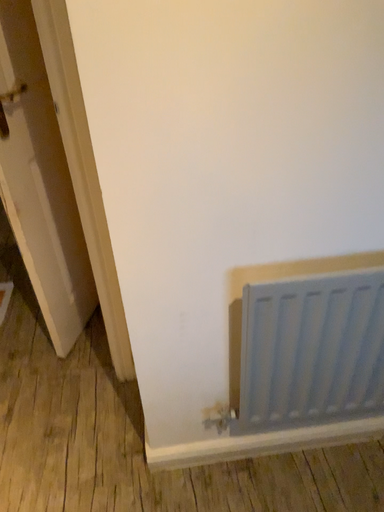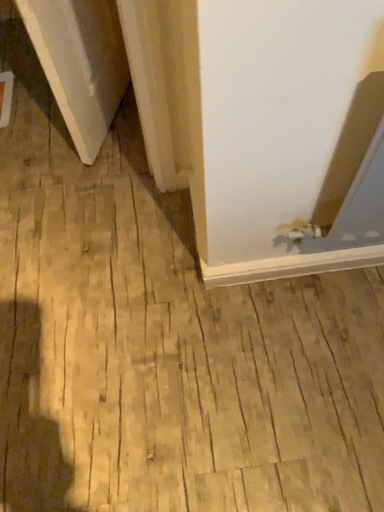
Question: How did the camera likely rotate when shooting the video?

Choices:
 (A) rotated downward
 (B) rotated upward

Answer: (A)